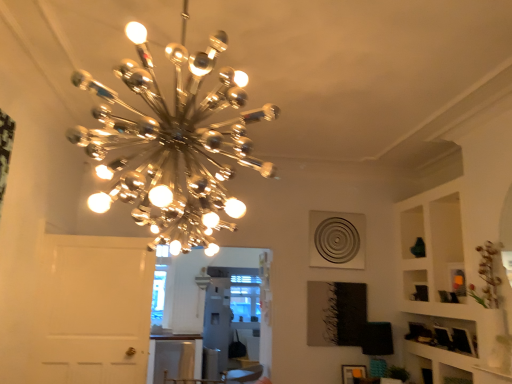
Question: Is matte orange picture frame at lower right in front of or behind chrome/metallic chandelier at upper center in the image?

Choices:
 (A) behind
 (B) front

Answer: (A)

Question: From a real-world perspective, relative to chrome/metallic chandelier at upper center, is matte orange picture frame at lower right vertically above or below?

Choices:
 (A) above
 (B) below

Answer: (B)

Question: Which is nearer to the chrome/metallic chandelier at upper center?

Choices:
 (A) matte orange picture frame at lower right
 (B) white glossy table at lower center

Answer: (A)

Question: Estimate the real-world distances between objects in this image. Which object is closer to the chrome/metallic chandelier at upper center?

Choices:
 (A) white glossy table at lower center
 (B) matte orange picture frame at lower right

Answer: (B)